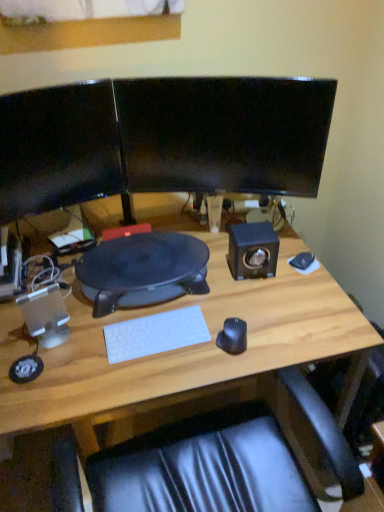
In order to click on vacant space behind black matte mouse at center in this screenshot , I will do `click(231, 301)`.